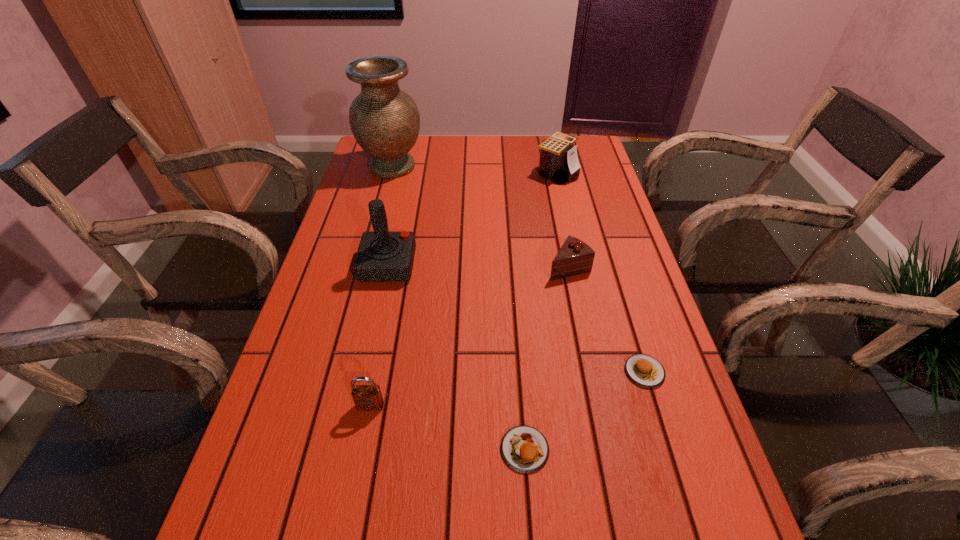
The image size is (960, 540). Identify the location of vase. (384, 120).

Where is `the second tallest object`? the second tallest object is located at coordinates (383, 256).

The height and width of the screenshot is (540, 960). Identify the location of calculator. (558, 162).

Locate an element on the screen. The image size is (960, 540). padlock is located at coordinates (366, 397).

I want to click on chocolate cake, so click(x=575, y=257).

In order to click on the nearest object in this screenshot , I will do click(525, 449).

Find the location of a particular element. This screenshot has width=960, height=540. the left food is located at coordinates (525, 449).

Locate an element on the screen. the right food is located at coordinates (645, 370).

This screenshot has width=960, height=540. What are the coordinates of `the fifth farthest object` in the screenshot? It's located at (645, 370).

The height and width of the screenshot is (540, 960). I want to click on vacant space located 0.110m on the right of the tallest object, so click(x=457, y=167).